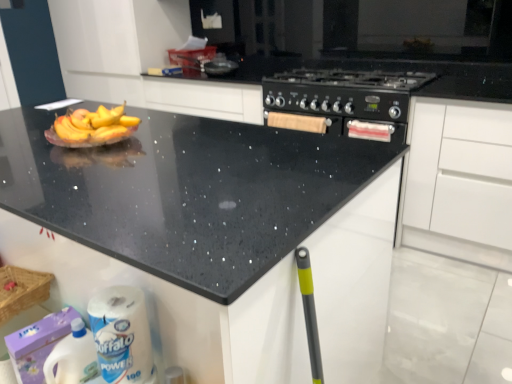
Question: Is white paper towel at lower left looking in the opposite direction of white matte cabinet at lower right?

Choices:
 (A) no
 (B) yes

Answer: (B)

Question: From the image's perspective, does white paper towel at lower left appear lower than white matte cabinet at lower right?

Choices:
 (A) yes
 (B) no

Answer: (A)

Question: Is the depth of white paper towel at lower left greater than that of white matte cabinet at lower right?

Choices:
 (A) yes
 (B) no

Answer: (B)

Question: Is white paper towel at lower left in contact with white matte cabinet at lower right?

Choices:
 (A) yes
 (B) no

Answer: (B)

Question: Can you confirm if white paper towel at lower left is smaller than white matte cabinet at lower right?

Choices:
 (A) no
 (B) yes

Answer: (B)

Question: Is white paper towel at lower left surrounding white matte cabinet at lower right?

Choices:
 (A) no
 (B) yes

Answer: (A)

Question: From the image's perspective, does black speckled granite at upper center appear lower than white plastic bottle at lower left?

Choices:
 (A) yes
 (B) no

Answer: (B)

Question: Considering the relative sizes of black speckled granite at upper center and white plastic bottle at lower left in the image provided, is black speckled granite at upper center bigger than white plastic bottle at lower left?

Choices:
 (A) no
 (B) yes

Answer: (B)

Question: Does black speckled granite at upper center have a greater height compared to white plastic bottle at lower left?

Choices:
 (A) yes
 (B) no

Answer: (A)

Question: Can you confirm if black speckled granite at upper center is thinner than white plastic bottle at lower left?

Choices:
 (A) no
 (B) yes

Answer: (A)

Question: Can we say black speckled granite at upper center lies outside white plastic bottle at lower left?

Choices:
 (A) yes
 (B) no

Answer: (A)

Question: From a real-world perspective, does black speckled granite at upper center sit lower than white plastic bottle at lower left?

Choices:
 (A) yes
 (B) no

Answer: (B)

Question: Considering the relative sizes of white plastic bottle at lower left and white paper towel at lower left in the image provided, is white plastic bottle at lower left taller than white paper towel at lower left?

Choices:
 (A) yes
 (B) no

Answer: (A)